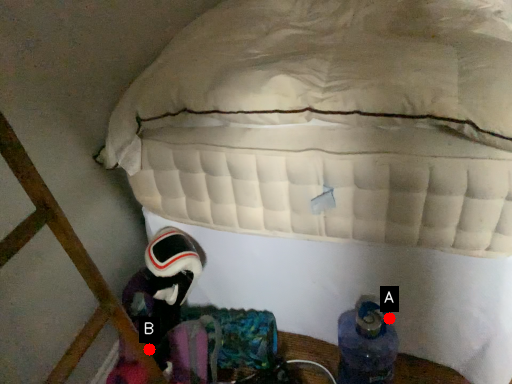
Question: Two points are circled on the image, labeled by A and B beside each circle. Which point is farther to the camera?

Choices:
 (A) A is further
 (B) B is further

Answer: (B)